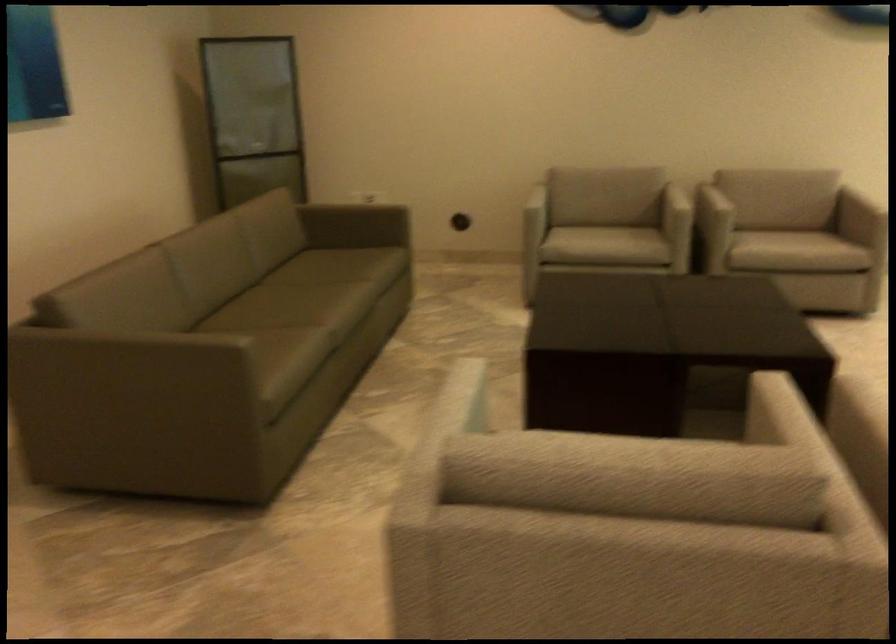
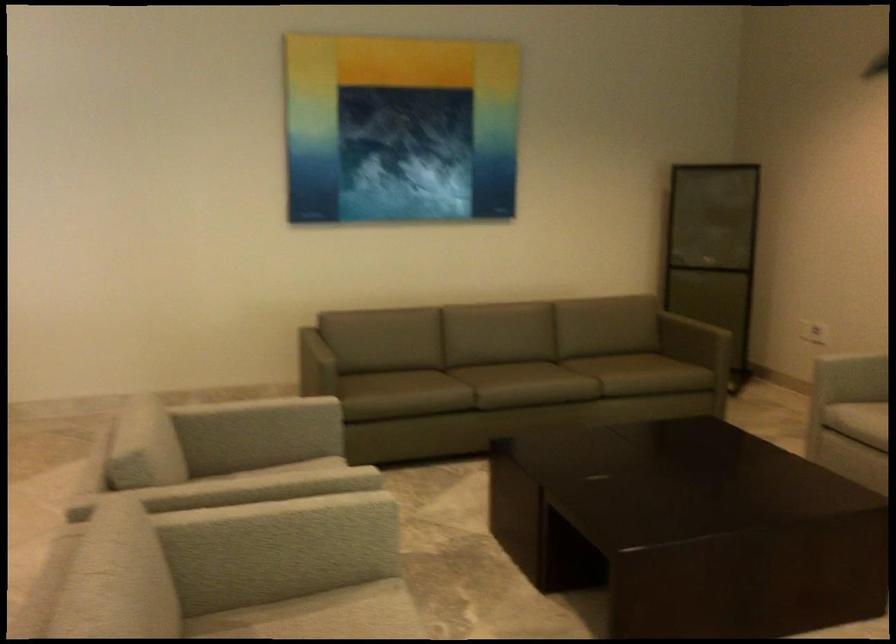
Find the pixel in the second image that matches pixel 796 415 in the first image.

(254, 484)